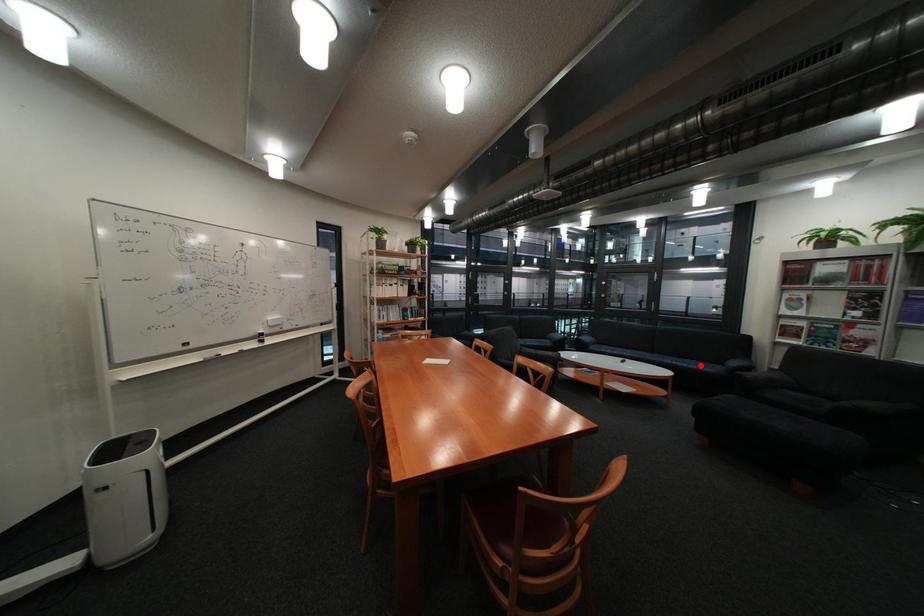
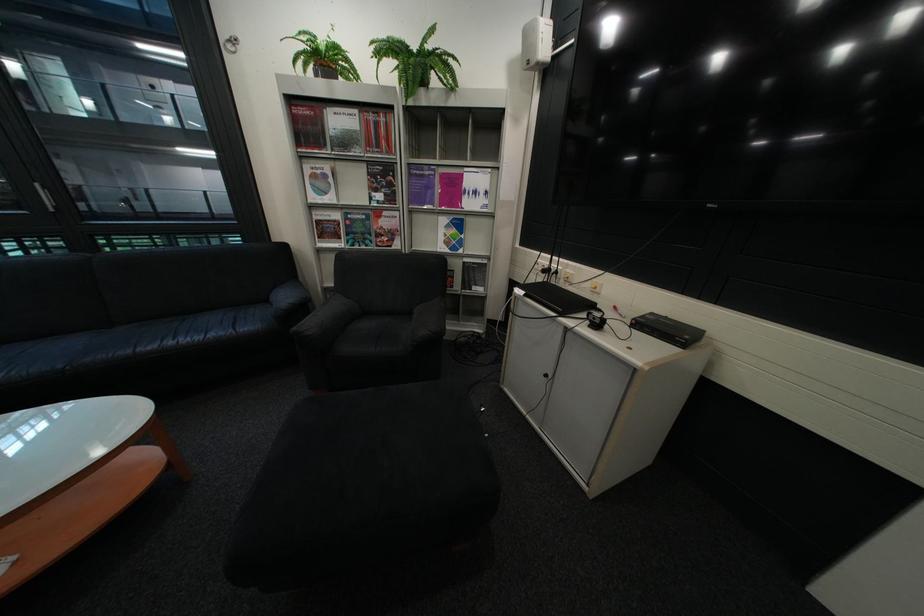
Where in the second image is the point corresponding to the highlighted location from the first image?

(213, 338)